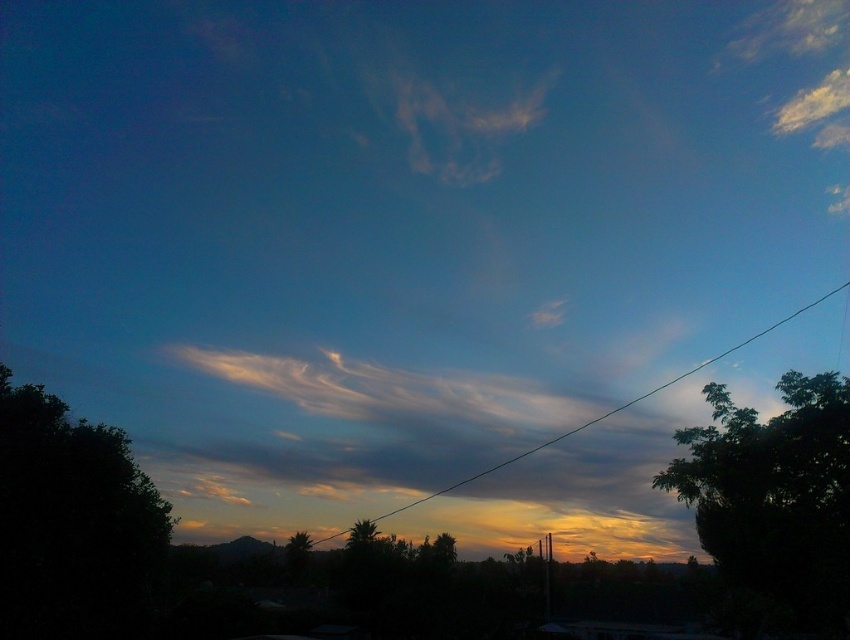
Between point (757, 592) and point (462, 481), which one is positioned behind?

The point (462, 481) is behind.

Is green leafy tree at right taller than green wire at center?

No, green leafy tree at right is not taller than green wire at center.

Between point (847, 436) and point (488, 468), which one is positioned in front?

Positioned in front is point (847, 436).

Where is `green leafy tree at right`? This screenshot has width=850, height=640. green leafy tree at right is located at coordinates (775, 497).

Is point (146, 502) positioned behind point (749, 556)?

No, it is not.

Consider the image. Does dark green leafy tree at left have a lesser height compared to green leafy tree at right?

No, dark green leafy tree at left is not shorter than green leafy tree at right.

Does point (112, 461) lie in front of point (692, 490)?

That is True.

Where is `dark green leafy tree at left`? This screenshot has width=850, height=640. dark green leafy tree at left is located at coordinates (72, 524).

The image size is (850, 640). What do you see at coordinates (72, 524) in the screenshot?
I see `dark green leafy tree at left` at bounding box center [72, 524].

Who is shorter, dark green leafy tree at left or green leafy tree at center?

green leafy tree at center is shorter.

Is point (55, 621) more distant than point (358, 531)?

No, (55, 621) is closer to viewer.

Where is `dark green leafy tree at left`? Image resolution: width=850 pixels, height=640 pixels. dark green leafy tree at left is located at coordinates (72, 524).